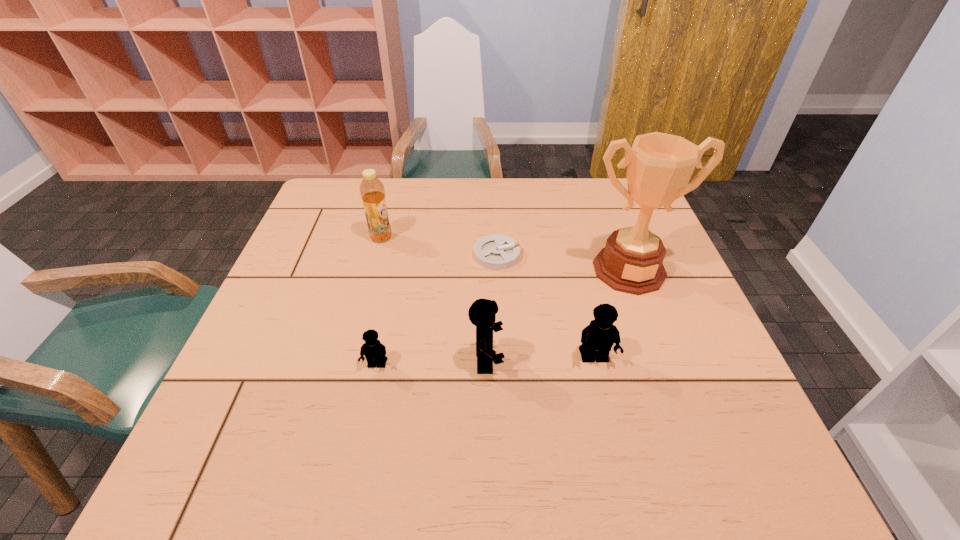
All Legos are currently evenly spaced. To continue this pattern, where would you add another Lego on the right? Please point out a vacant spot. Please provide its 2D coordinates. Your answer should be formatted as a tuple, i.e. [(x, y)], where the tuple contains the x and y coordinates of a point satisfying the conditions above.

[(701, 355)]